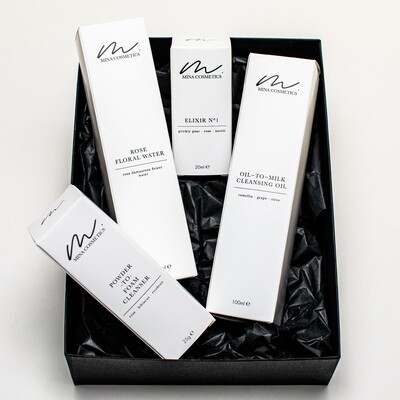
The image size is (400, 400). Identify the location of box. point(182,258).